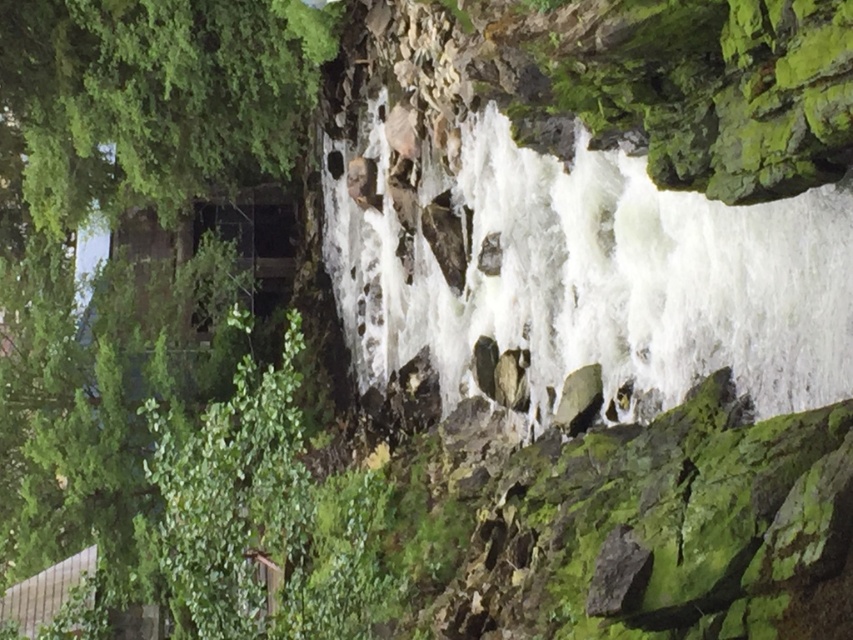
Where is `white frothy water at center`? The height and width of the screenshot is (640, 853). white frothy water at center is located at coordinates (598, 280).

Who is more forward, (x=689, y=300) or (x=73, y=74)?

Positioned in front is point (x=689, y=300).

Find the location of a particular element. The width and height of the screenshot is (853, 640). white frothy water at center is located at coordinates (598, 280).